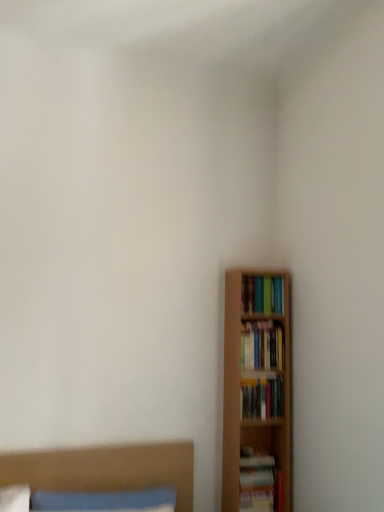
Find the location of `free spot above hardcover book at lower right, arranged as the first book when ordered from the bottom (from a real-world perspective)`. free spot above hardcover book at lower right, arranged as the first book when ordered from the bottom (from a real-world perspective) is located at coordinates (255, 452).